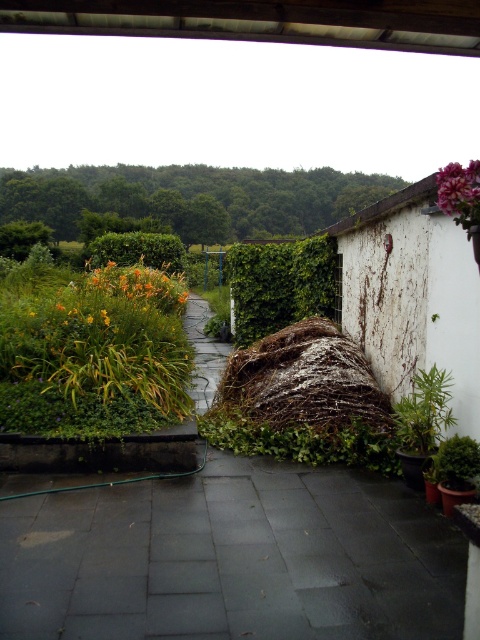
Between green stone path at center and brown textured hay at center, which one has more height?

Standing taller between the two is brown textured hay at center.

Who is shorter, green stone path at center or brown textured hay at center?

With less height is green stone path at center.

Does point (402, 500) come farther from viewer compared to point (269, 346)?

No.

Where is `green stone path at center`? green stone path at center is located at coordinates (232, 557).

Locate an element on the screen. yellow matte flower at upper left is located at coordinates (142, 285).

Describe the element at coordinates (142, 285) in the screenshot. I see `yellow matte flower at upper left` at that location.

Measure the distance between yellow matte flower at upper left and camera.

A distance of 14.36 meters exists between yellow matte flower at upper left and camera.

Find the location of `yellow matte flower at upper left`. yellow matte flower at upper left is located at coordinates (142, 285).

Does brown textured hay at center appear on the right side of yellow matte flower at upper left?

Indeed, brown textured hay at center is positioned on the right side of yellow matte flower at upper left.

Between point (259, 372) and point (141, 292), which one is positioned in front?

Positioned in front is point (259, 372).

Where is `brown textured hay at center`? Image resolution: width=480 pixels, height=640 pixels. brown textured hay at center is located at coordinates (302, 381).